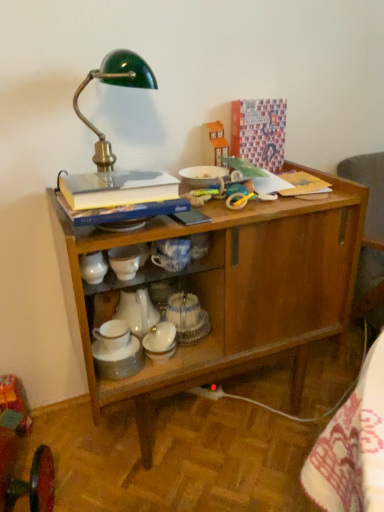
Describe the element at coordinates (117, 188) in the screenshot. I see `hardcover book at upper left` at that location.

Describe the element at coordinates (238, 293) in the screenshot. The width and height of the screenshot is (384, 512). I see `wooden cabinet at center` at that location.

Identify the location of hardcover book at upper left. This screenshot has width=384, height=512. (117, 188).

Which of these two, white porcelain teapot at center or green enameled metal desk lamp at upper left, is wider?

green enameled metal desk lamp at upper left.

Is white porcelain teapot at center behind green enameled metal desk lamp at upper left?

Yes, white porcelain teapot at center is behind green enameled metal desk lamp at upper left.

Would you consider white porcelain teapot at center to be distant from green enameled metal desk lamp at upper left?

That's not correct — white porcelain teapot at center is a little close to green enameled metal desk lamp at upper left.

Based on the photo, does white porcelain teapot at center turn towards green enameled metal desk lamp at upper left?

No, white porcelain teapot at center is not oriented towards green enameled metal desk lamp at upper left.

In the scene shown: How much distance is there between green enameled metal desk lamp at upper left and wooden cabinet at center?

green enameled metal desk lamp at upper left is 49.19 centimeters from wooden cabinet at center.

From the image's perspective, is green enameled metal desk lamp at upper left located above or below wooden cabinet at center?

green enameled metal desk lamp at upper left is situated higher than wooden cabinet at center in the image.

Is green enameled metal desk lamp at upper left at the left side of wooden cabinet at center?

Correct, you'll find green enameled metal desk lamp at upper left to the left of wooden cabinet at center.

Which is correct: green enameled metal desk lamp at upper left is inside wooden cabinet at center, or outside of it?

The correct answer is: outside.

Considering the sizes of hardcover book at upper left and white porcelain teapot at center in the image, is hardcover book at upper left wider or thinner than white porcelain teapot at center?

Clearly, hardcover book at upper left has more width compared to white porcelain teapot at center.

Which object is positioned more to the right, hardcover book at upper left or white porcelain teapot at center?

hardcover book at upper left.

At what (x,y) coordinates should I click in order to perform the action: click on book above the white porcelain teapot at center (from the image's perspective). Please return your answer as a coordinate pair (x, y). Image resolution: width=384 pixels, height=512 pixels. Looking at the image, I should click on (117, 188).

Measure the distance between hardcover book at upper left and white porcelain teapot at center.

17.31 inches.

In the scene shown: Is green enameled metal desk lamp at upper left positioned far away from hardcover book at upper left?

No, green enameled metal desk lamp at upper left is in close proximity to hardcover book at upper left.

Considering the sizes of objects green enameled metal desk lamp at upper left and hardcover book at upper left in the image provided, who is taller, green enameled metal desk lamp at upper left or hardcover book at upper left?

green enameled metal desk lamp at upper left is taller.

Between green enameled metal desk lamp at upper left and hardcover book at upper left, which one has smaller width?

hardcover book at upper left.

Does green enameled metal desk lamp at upper left come behind hardcover book at upper left?

Yes, green enameled metal desk lamp at upper left is further from the camera.

Is wooden cabinet at center shorter than green enameled metal desk lamp at upper left?

In fact, wooden cabinet at center may be taller than green enameled metal desk lamp at upper left.

In terms of size, does wooden cabinet at center appear bigger or smaller than green enameled metal desk lamp at upper left?

Considering their sizes, wooden cabinet at center takes up more space than green enameled metal desk lamp at upper left.

From a real-world perspective, does wooden cabinet at center sit lower than green enameled metal desk lamp at upper left?

Yes.

Who is more distant, wooden cabinet at center or green enameled metal desk lamp at upper left?

green enameled metal desk lamp at upper left is behind.

Is hardcover book at upper left positioned behind green enameled metal desk lamp at upper left?

That is False.

Considering the relative sizes of hardcover book at upper left and green enameled metal desk lamp at upper left in the image provided, is hardcover book at upper left taller than green enameled metal desk lamp at upper left?

No, hardcover book at upper left is not taller than green enameled metal desk lamp at upper left.

Is point (114, 203) closer to camera compared to point (135, 62)?

Yes, it is.

Consider the image. Which object is thinner, hardcover book at upper left or green enameled metal desk lamp at upper left?

hardcover book at upper left.

Is wooden cabinet at center facing away from white porcelain teapot at center?

No, white porcelain teapot at center is not at the back of wooden cabinet at center.

Can you tell me how much wooden cabinet at center and white porcelain teapot at center differ in facing direction?

0.000731 degrees.

From the image's perspective, does wooden cabinet at center appear lower than white porcelain teapot at center?

Actually, wooden cabinet at center appears above white porcelain teapot at center in the image.

Which object is further away from the camera taking this photo, wooden cabinet at center or white porcelain teapot at center?

white porcelain teapot at center is behind.

Identify the location of table lamp above the white porcelain teapot at center (from a real-world perspective). (116, 85).

Image resolution: width=384 pixels, height=512 pixels. I want to click on table lamp on the left of the wooden cabinet at center, so click(x=116, y=85).

Considering their positions, is wooden cabinet at center positioned closer to white porcelain teapot at center than hardcover book at upper left?

Among the two, wooden cabinet at center is located nearer to white porcelain teapot at center.

Which object lies further to the anchor point wooden cabinet at center, green enameled metal desk lamp at upper left or white porcelain teapot at center?

green enameled metal desk lamp at upper left is positioned further to the anchor wooden cabinet at center.

Which object lies further to the anchor point green enameled metal desk lamp at upper left, hardcover book at upper left or wooden cabinet at center?

Among the two, wooden cabinet at center is located further to green enameled metal desk lamp at upper left.

Estimate the real-world distances between objects in this image. Which object is further from white porcelain teapot at center, hardcover book at upper left or wooden cabinet at center?

hardcover book at upper left is further to white porcelain teapot at center.

Estimate the real-world distances between objects in this image. Which object is closer to white porcelain teapot at center, green enameled metal desk lamp at upper left or wooden cabinet at center?

wooden cabinet at center.

Estimate the real-world distances between objects in this image. Which object is further from wooden cabinet at center, white porcelain teapot at center or green enameled metal desk lamp at upper left?

green enameled metal desk lamp at upper left is positioned further to the anchor wooden cabinet at center.

Based on their spatial positions, is white porcelain teapot at center or wooden cabinet at center further from hardcover book at upper left?

white porcelain teapot at center is further to hardcover book at upper left.

Which object lies nearer to the anchor point hardcover book at upper left, green enameled metal desk lamp at upper left or wooden cabinet at center?

green enameled metal desk lamp at upper left lies closer to hardcover book at upper left than the other object.

At what (x,y) coordinates should I click in order to perform the action: click on desk between green enameled metal desk lamp at upper left and white porcelain teapot at center in the up-down direction. Please return your answer as a coordinate pair (x, y). Looking at the image, I should click on (238, 293).

Locate an element on the screen. This screenshot has width=384, height=512. book between green enameled metal desk lamp at upper left and wooden cabinet at center in the vertical direction is located at coordinates (117, 188).

Image resolution: width=384 pixels, height=512 pixels. What are the coordinates of `desk that lies between hardcover book at upper left and white porcelain teapot at center from top to bottom` in the screenshot? It's located at (238, 293).

Locate an element on the screen. The height and width of the screenshot is (512, 384). book between green enameled metal desk lamp at upper left and white porcelain teapot at center in the vertical direction is located at coordinates (117, 188).